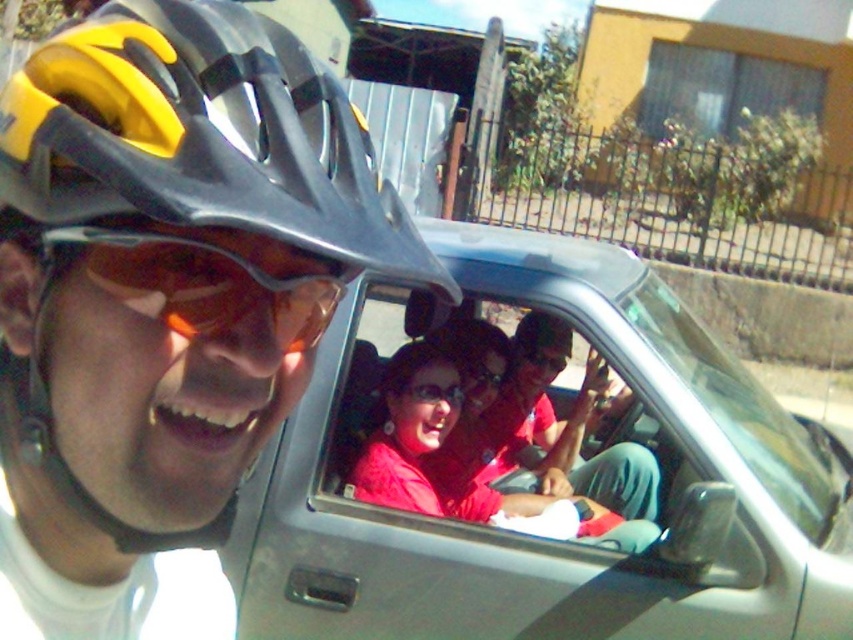
What are the coordinates of the matte black helmet at left?

The matte black helmet at left is located at coordinates point (202, 134).

You are standing in front of the vehicle and want to know what is at the center of the image. According to the coordinates provided, what object is located at point (537, 477)?

The point (537, 477) indicates the silver metallic car at center.